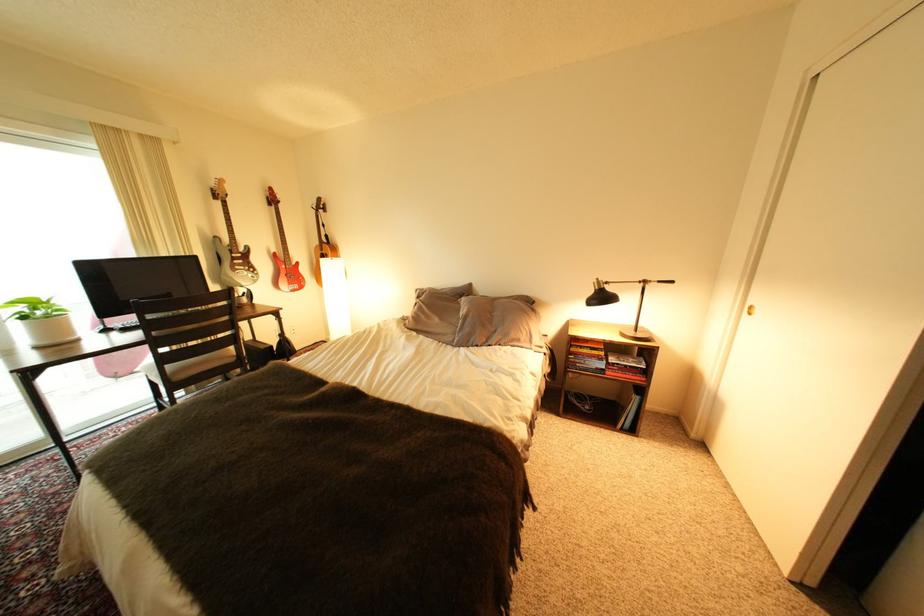
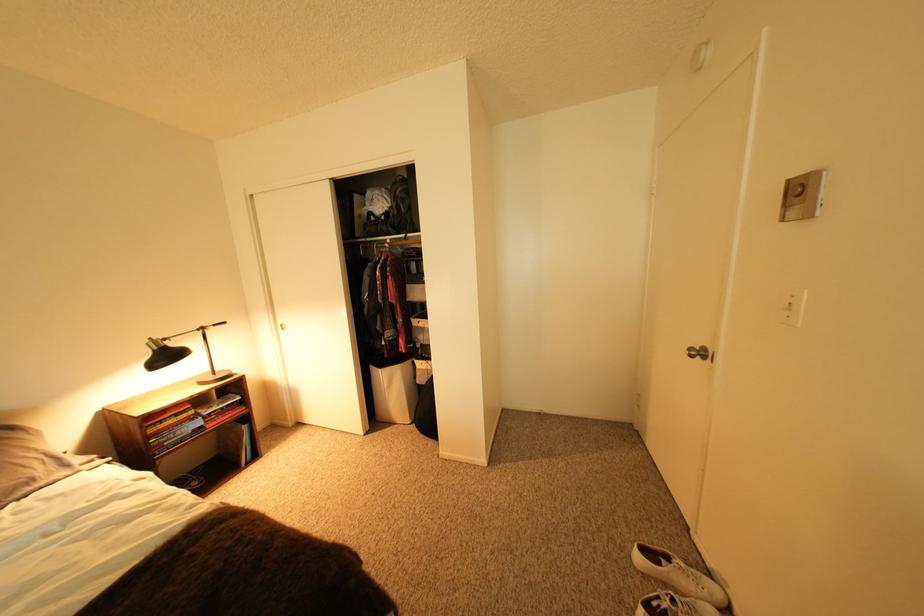
Locate, in the second image, the point that corresponds to pixel 610 290 in the first image.

(168, 350)